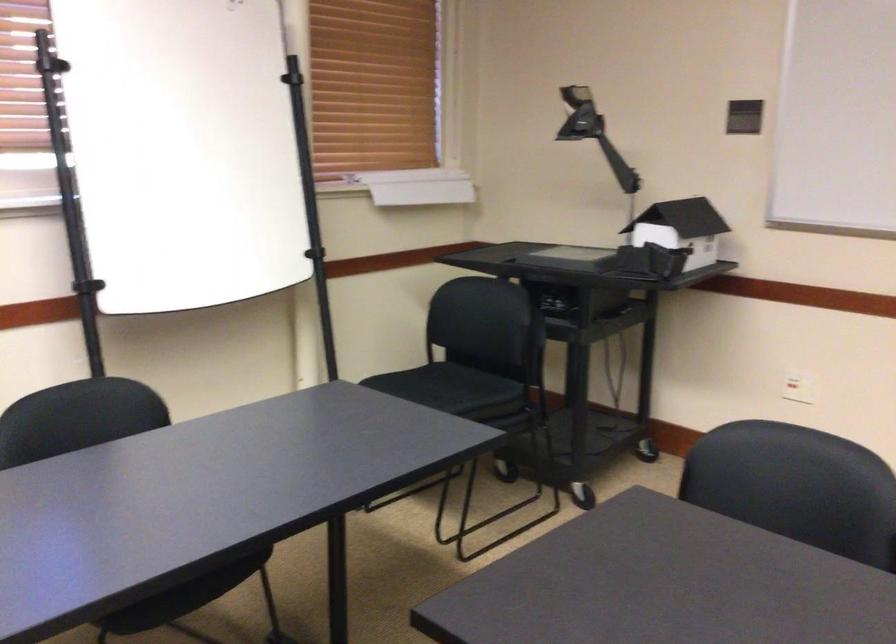
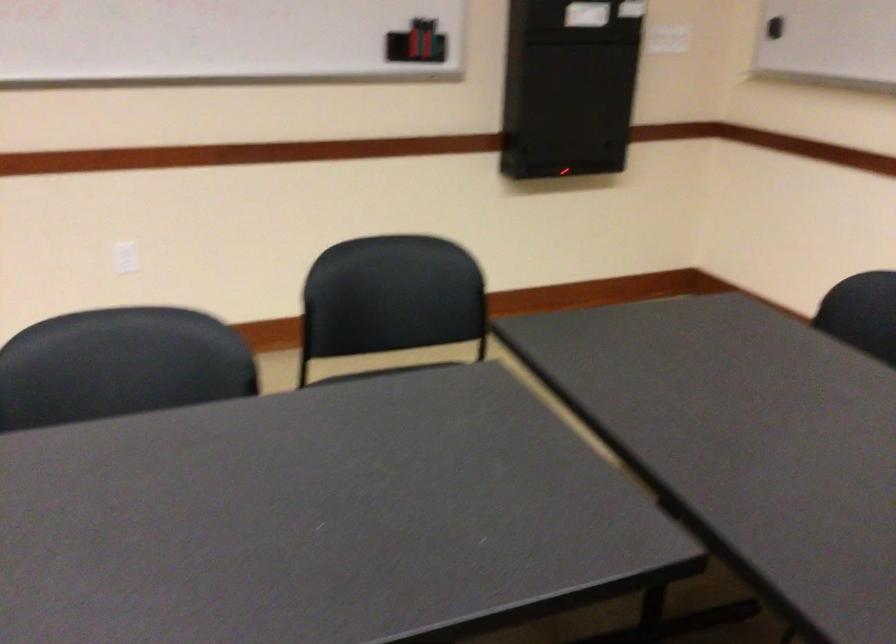
Question: The images are taken continuously from a first-person perspective. In which direction is your viewpoint rotating?

Choices:
 (A) Left
 (B) Right
 (C) Up
 (D) Down

Answer: (B)